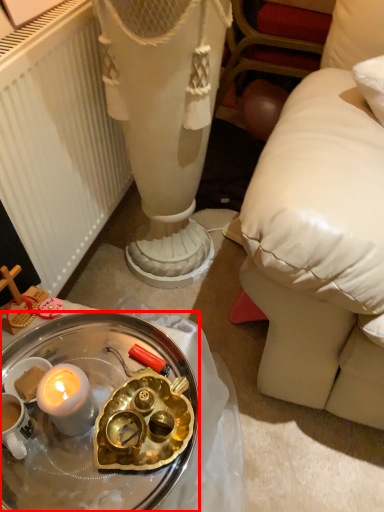
Question: From the image's perspective, considering the relative positions of desk (annotated by the red box) and radiator in the image provided, where is desk (annotated by the red box) located with respect to the staircase?

Choices:
 (A) above
 (B) below

Answer: (B)